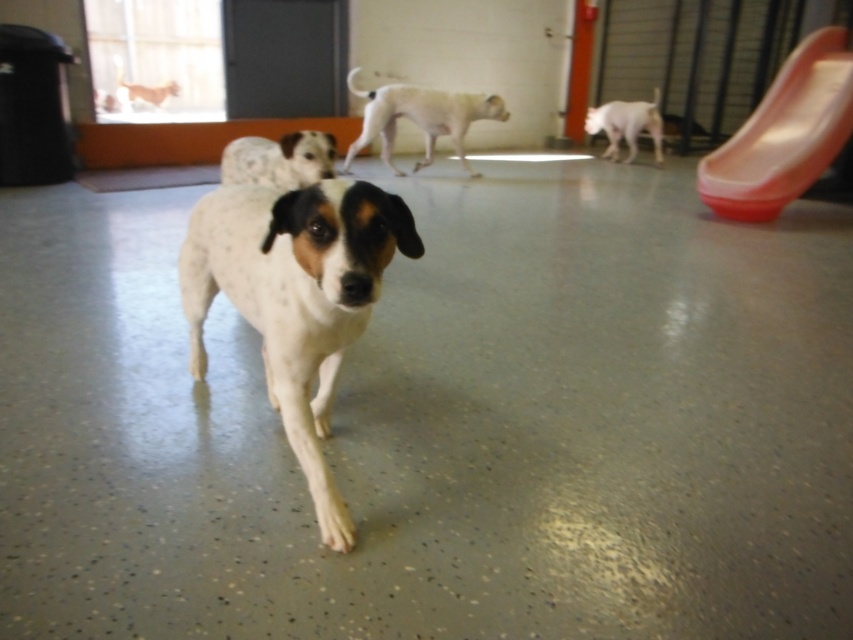
Which of these two, rubberized orange slide at upper right or white smooth dog at upper right, stands shorter?

With less height is white smooth dog at upper right.

In the scene shown: Does rubberized orange slide at upper right have a greater width compared to white smooth dog at upper right?

Yes.

Which is in front, point (807, 166) or point (614, 134)?

Point (807, 166) is more forward.

Where is `rubberized orange slide at upper right`? The width and height of the screenshot is (853, 640). rubberized orange slide at upper right is located at coordinates (784, 132).

Who is higher up, speckled white dog at center or white smooth dog at center?

white smooth dog at center is above.

The image size is (853, 640). What do you see at coordinates (294, 296) in the screenshot? I see `speckled white dog at center` at bounding box center [294, 296].

Locate an element on the screen. speckled white dog at center is located at coordinates (294, 296).

Is speckled white dog at center shorter than speckled fur dog at center?

Incorrect, speckled white dog at center's height does not fall short of speckled fur dog at center's.

Is point (403, 237) positioned behind point (314, 138)?

No, it is not.

Find the location of a particular element. The width and height of the screenshot is (853, 640). speckled white dog at center is located at coordinates (294, 296).